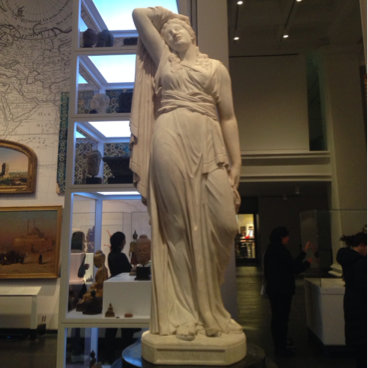
The image size is (368, 368). Find the location of `table`. table is located at coordinates (93, 314).